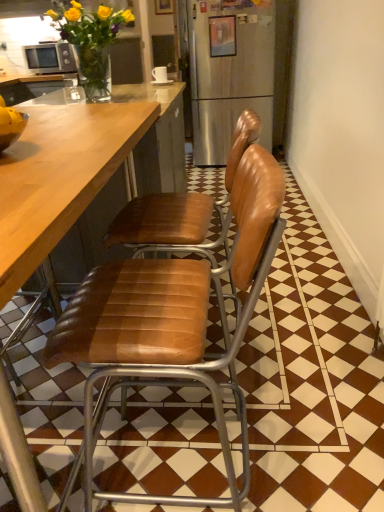
Where is `unoccupied region to the right of brown leather chair at center, the 2th chair from the front`? unoccupied region to the right of brown leather chair at center, the 2th chair from the front is located at coordinates (303, 352).